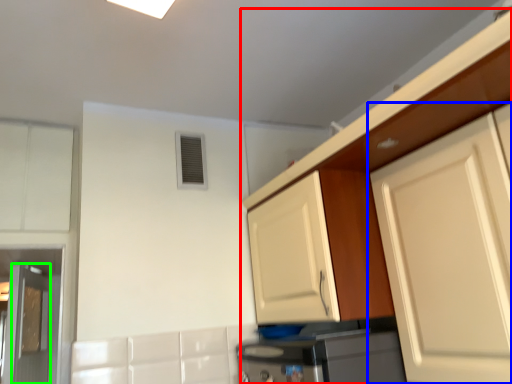
Question: Which object is positioned farthest from cabinetry (highlighted by a red box)? Select from cabinetry (highlighted by a blue box) and door (highlighted by a green box).

Choices:
 (A) cabinetry
 (B) door

Answer: (B)